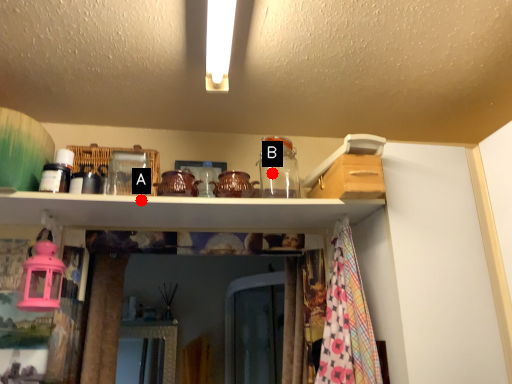
Question: Two points are circled on the image, labeled by A and B beside each circle. Which point is closer to the camera taking this photo?

Choices:
 (A) A is closer
 (B) B is closer

Answer: (A)